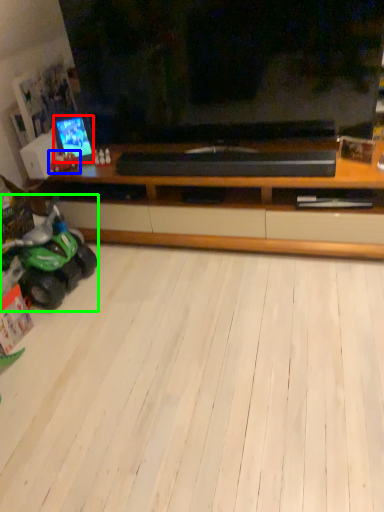
Question: Estimate the real-world distances between objects in this image. Which object is closer to tv show (highlighted by a red box), land vehicle (highlighted by a blue box) or land vehicle (highlighted by a green box)?

Choices:
 (A) land vehicle
 (B) land vehicle

Answer: (A)